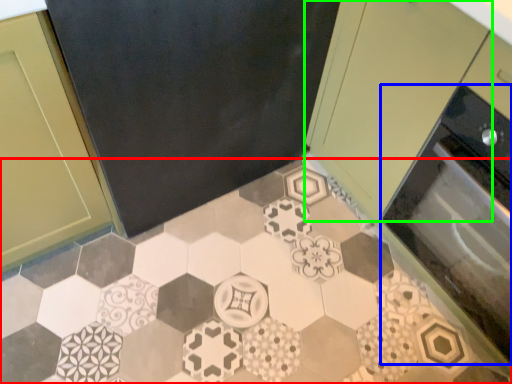
Question: Based on their relative distances, which object is nearer to ceramic tile (highlighted by a red box)? Choose from oven (highlighted by a blue box) and cabinetry (highlighted by a green box).

Choices:
 (A) oven
 (B) cabinetry

Answer: (A)